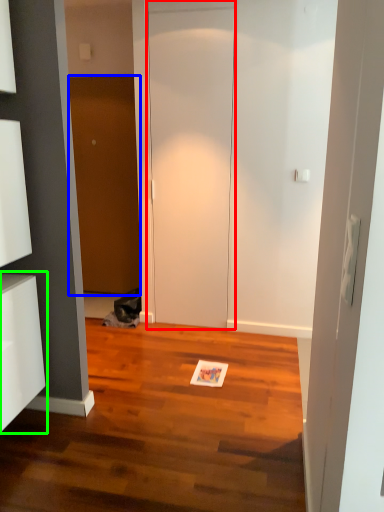
Question: Based on their relative distances, which object is nearer to door (highlighted by a red box)? Choose from door (highlighted by a blue box) and cabinetry (highlighted by a green box).

Choices:
 (A) door
 (B) cabinetry

Answer: (A)